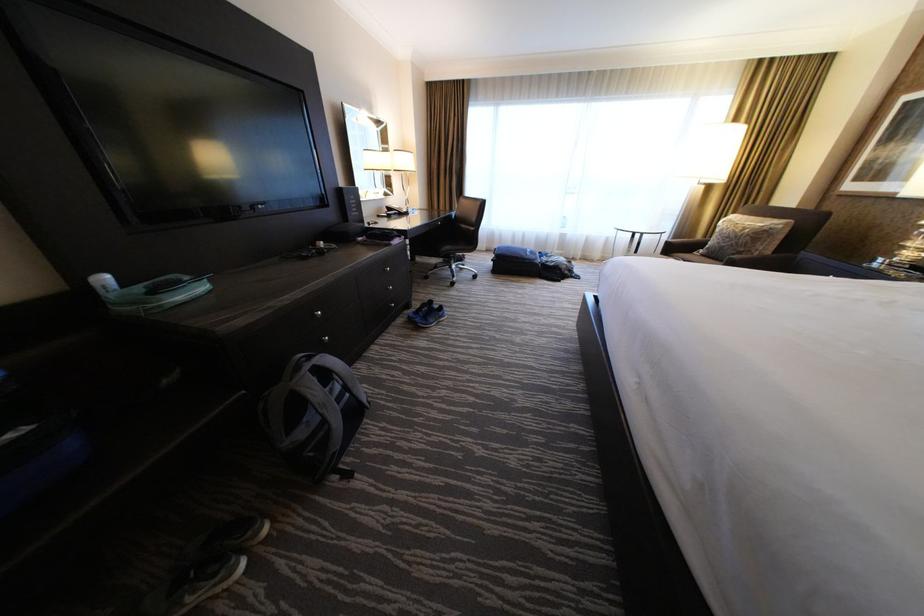
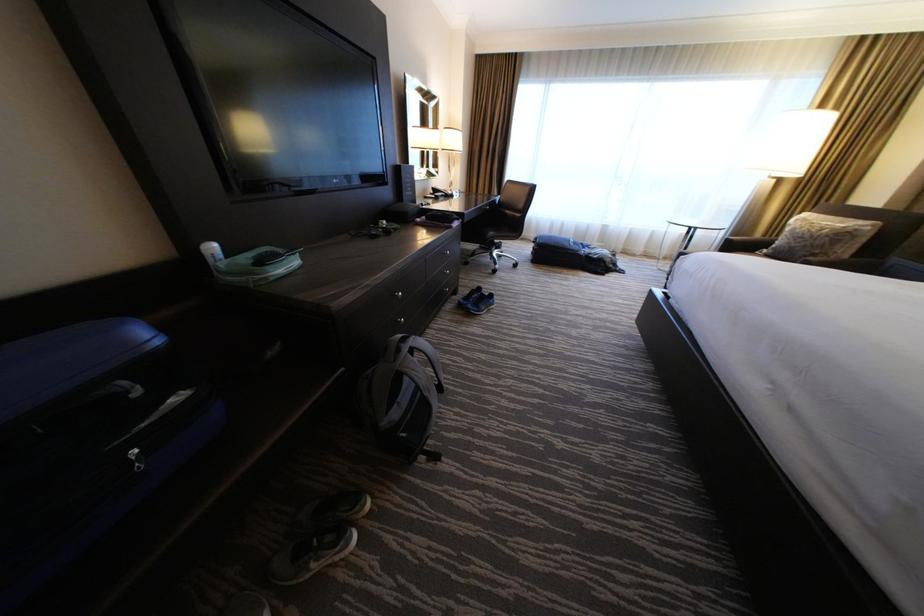
Question: Which direction would the cameraman need to move to produce the second image? Reply with the corresponding letter.

Choices:
 (A) Left
 (B) Right
 (C) Forward
 (D) Backward

Answer: (A)